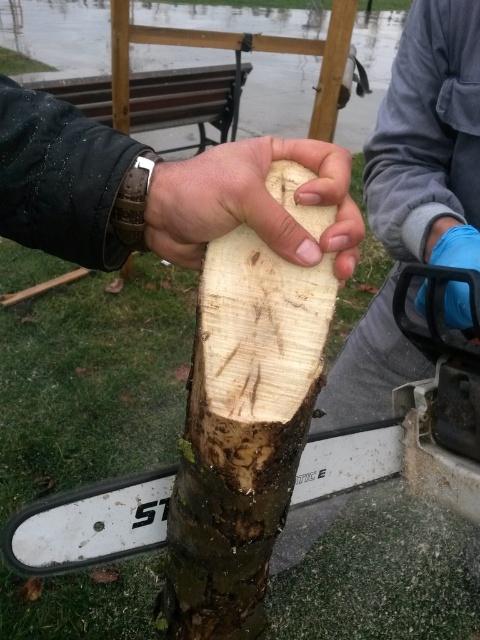
You are a carpenter working on a project and need to position the light brown wood at center and the wooden plank at center correctly. According to the image, which object is positioned to the right side?

The light brown wood at center is to the right of wooden plank at center, so the light brown wood at center is positioned to the right side.

You are a safety inspector observing the chainsaw operation. You notice two objects at the center of the scene. Which object is closer to you, the light brown wood at center or the wooden plank at center?

The light brown wood at center is closer to you because it is in front of the wooden plank at center according to the description.